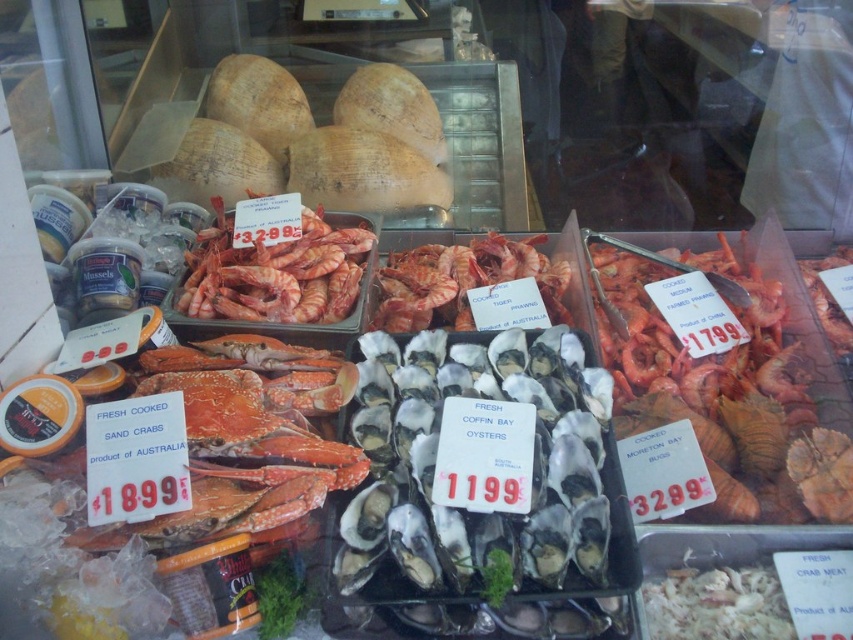
Question: Which object appears farthest from the camera in this image?

Choices:
 (A) red matte tiger prawns at center
 (B) shiny pink prawns at center

Answer: (A)

Question: Among these objects, which one is farthest from the camera?

Choices:
 (A) shiny pink prawns at center
 (B) red matte tiger prawns at center

Answer: (B)

Question: Does shiny pink prawns at center appear on the right side of red matte tiger prawns at center?

Choices:
 (A) yes
 (B) no

Answer: (B)

Question: Which object is the closest to the red matte tiger prawns at center?

Choices:
 (A) white shell oysters at center
 (B) shiny pink prawns at center

Answer: (B)

Question: Does shiny pink prawns at center lie in front of red matte tiger prawns at center?

Choices:
 (A) no
 (B) yes

Answer: (B)

Question: Is white shell oysters at center positioned before shiny pink prawns at center?

Choices:
 (A) no
 (B) yes

Answer: (B)